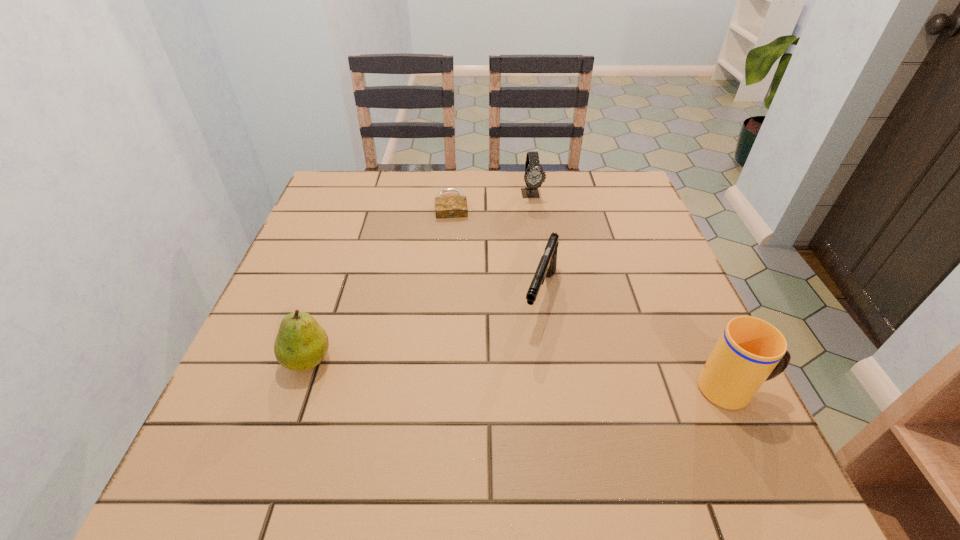
Locate an element on the screen. object that is at the right edge is located at coordinates (750, 351).

Locate an element on the screen. The image size is (960, 540). object located in the near right corner section of the desktop is located at coordinates (750, 351).

The height and width of the screenshot is (540, 960). In order to click on vacant space at the far edge in this screenshot , I will do `click(477, 186)`.

You are a GUI agent. You are given a task and a screenshot of the screen. Output one action in this format:
    pyautogui.click(x=<x>, y=<y>)
    Task: Click on the vacant space at the near edge
    This screenshot has width=960, height=540.
    Given the screenshot: What is the action you would take?
    pyautogui.click(x=603, y=420)

Find the location of a particular element. The height and width of the screenshot is (540, 960). vacant space at the left edge of the desktop is located at coordinates (305, 305).

Where is `free space at the right edge of the desktop`? free space at the right edge of the desktop is located at coordinates (655, 325).

In the image, there is a desktop. Where is `vacant space at the far left corner`? The height and width of the screenshot is (540, 960). vacant space at the far left corner is located at coordinates (357, 200).

In order to click on free location at the far right corner of the desktop in this screenshot , I will do `click(617, 207)`.

You are a GUI agent. You are given a task and a screenshot of the screen. Output one action in this format:
    pyautogui.click(x=<x>, y=<y>)
    Task: Click on the free space at the near right corner of the desktop
    The width and height of the screenshot is (960, 540).
    Given the screenshot: What is the action you would take?
    pos(746,429)

What are the coordinates of `vacant space that is in between the leftmost object and the gun` in the screenshot? It's located at (424, 328).